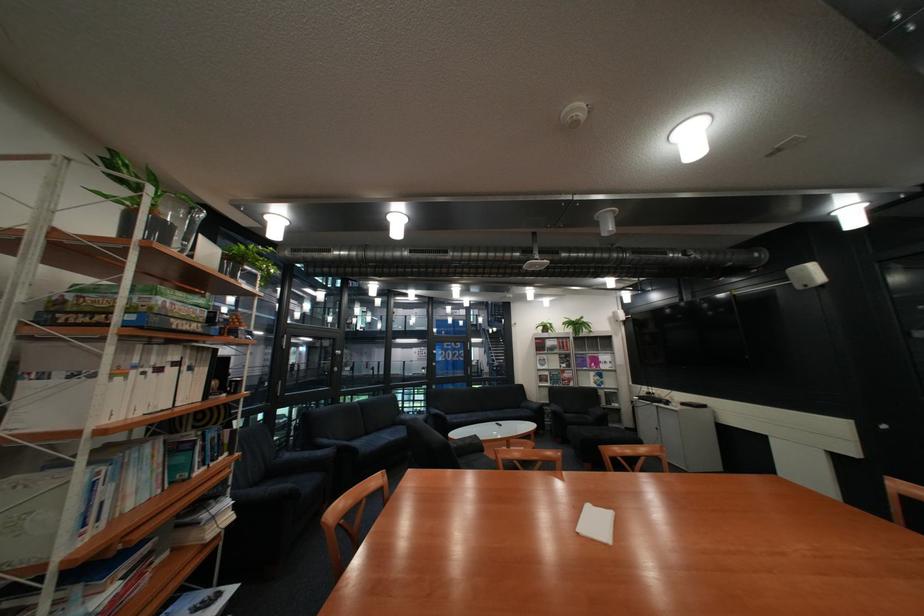
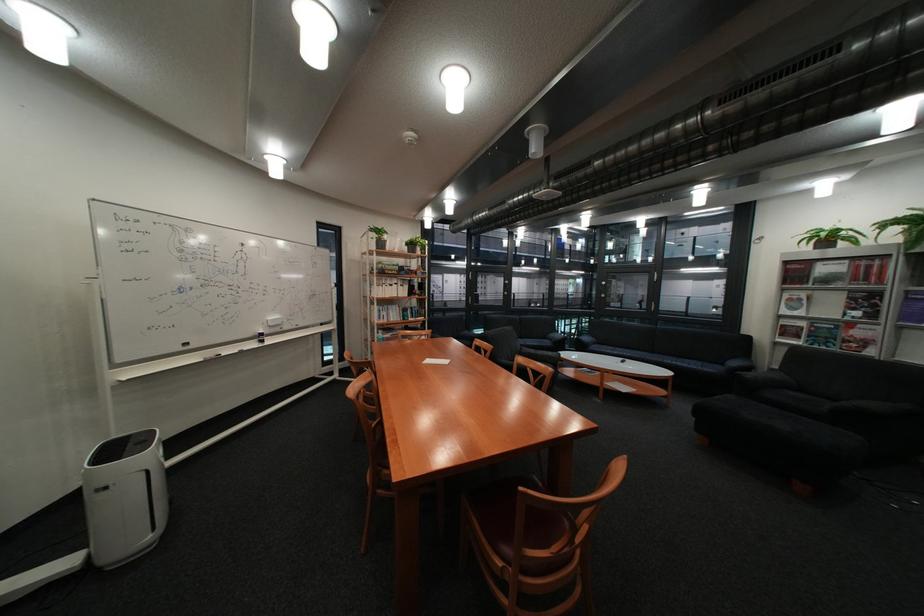
In the second image, find the point that corresponds to pixel 66 211 in the first image.

(383, 246)